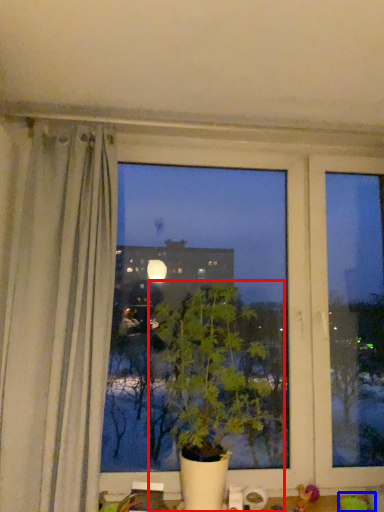
Question: Which of the following is the farthest to the observer, houseplant (highlighted by a red box) or toy (highlighted by a blue box)?

Choices:
 (A) houseplant
 (B) toy

Answer: (B)